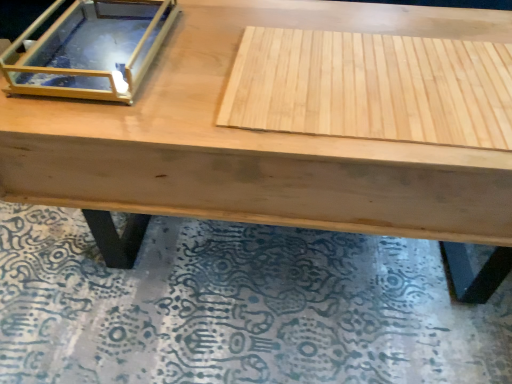
Question: Can you confirm if clear glass box at upper left is taller than wooden mat at lower center?

Choices:
 (A) yes
 (B) no

Answer: (A)

Question: From the image's perspective, is clear glass box at upper left located above wooden mat at lower center?

Choices:
 (A) yes
 (B) no

Answer: (A)

Question: Could you tell me if clear glass box at upper left is turned towards wooden mat at lower center?

Choices:
 (A) yes
 (B) no

Answer: (B)

Question: Can wooden mat at lower center be found inside clear glass box at upper left?

Choices:
 (A) yes
 (B) no

Answer: (B)

Question: Is clear glass box at upper left located outside wooden mat at lower center?

Choices:
 (A) yes
 (B) no

Answer: (A)

Question: Visually, is clear glass box at upper left positioned to the left or to the right of natural wood plywood at center?

Choices:
 (A) left
 (B) right

Answer: (A)

Question: Is point (8, 64) closer or farther from the camera than point (478, 57)?

Choices:
 (A) closer
 (B) farther

Answer: (A)

Question: From the image's perspective, is clear glass box at upper left above or below natural wood plywood at center?

Choices:
 (A) below
 (B) above

Answer: (B)

Question: From a real-world perspective, relative to natural wood plywood at center, is clear glass box at upper left vertically above or below?

Choices:
 (A) above
 (B) below

Answer: (A)

Question: Considering the positions of point (337, 281) and point (128, 43), is point (337, 281) closer or farther from the camera than point (128, 43)?

Choices:
 (A) farther
 (B) closer

Answer: (A)

Question: From the image's perspective, is wooden mat at lower center above or below clear glass box at upper left?

Choices:
 (A) below
 (B) above

Answer: (A)

Question: Do you think wooden mat at lower center is within clear glass box at upper left, or outside of it?

Choices:
 (A) outside
 (B) inside

Answer: (A)

Question: Is wooden mat at lower center to the left or to the right of clear glass box at upper left in the image?

Choices:
 (A) left
 (B) right

Answer: (B)

Question: In terms of size, does clear glass box at upper left appear bigger or smaller than wooden mat at lower center?

Choices:
 (A) small
 (B) big

Answer: (A)

Question: From a real-world perspective, is clear glass box at upper left positioned above or below wooden mat at lower center?

Choices:
 (A) below
 (B) above

Answer: (B)